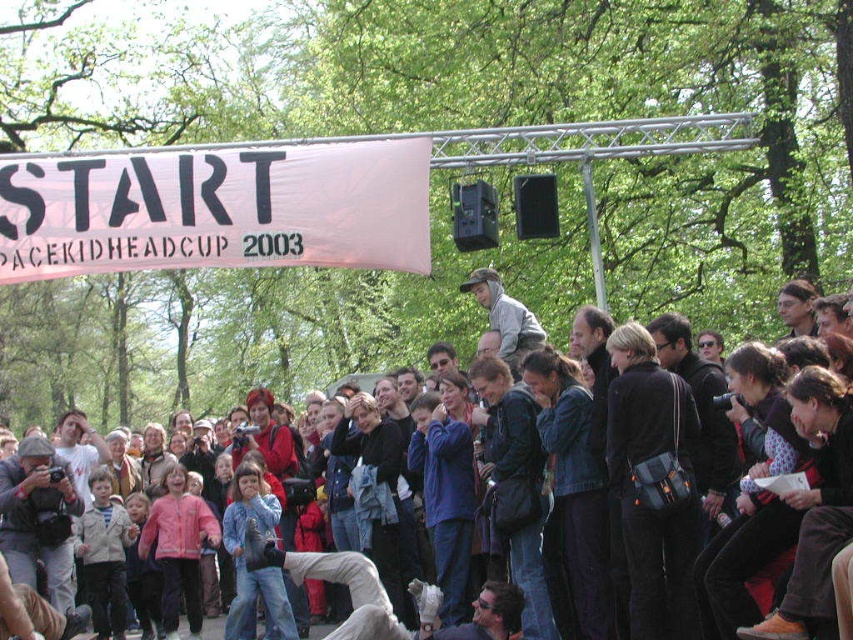
You are a photographer at the starting line of the race event. You want to capture a photo that includes both the blue denim jacket at center and the white fabric banner at upper center. Considering their sizes, which object should you focus on first to ensure both are clearly visible in the frame?

The blue denim jacket at center is larger than the white fabric banner at upper center. To ensure both are clearly visible, focus on the blue denim jacket at center first as it requires more space in the frame, then adjust the framing to include the smaller white fabric banner at upper center.

You are a photographer at the starting line of the PACEKIDHEADCUP 2003 race event. You want to capture a photo that includes both the white fabric banner at upper center and the matte black jacket at center. Can you position yourself so that the banner is visible above the jacket in the photo?

The white fabric banner at upper center is already positioned above the matte black jacket at center, so yes, you can take the photo from your current position to ensure the banner appears above the jacket.